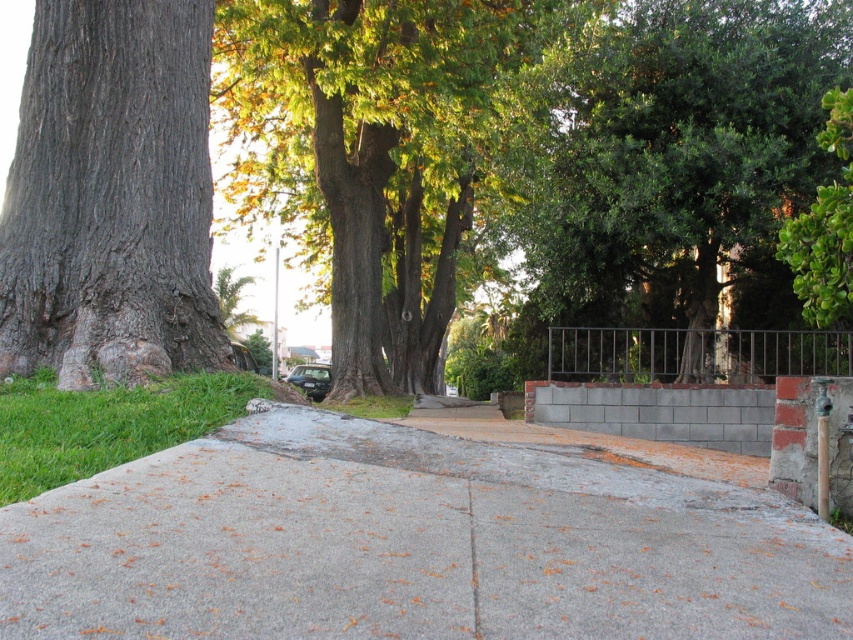
How distant is gray concrete pavement at center from green leafy tree at center?

19.36 meters

Which is above, gray concrete pavement at center or green leafy tree at center?

green leafy tree at center is above.

Which is in front, point (280, 406) or point (500, 45)?

Positioned in front is point (280, 406).

This screenshot has width=853, height=640. I want to click on gray concrete pavement at center, so click(410, 545).

Which is more to the left, gray concrete pavement at center or gray concrete curb at center?

Positioned to the left is gray concrete pavement at center.

Is point (624, 589) positioned before point (737, 426)?

Yes, point (624, 589) is in front of point (737, 426).

Find the location of a particular element. gray concrete pavement at center is located at coordinates (410, 545).

What do you see at coordinates (410, 545) in the screenshot? I see `gray concrete pavement at center` at bounding box center [410, 545].

Which is more to the left, gray concrete pavement at center or brown rough bark tree at left?

brown rough bark tree at left is more to the left.

Does point (618, 499) lie in front of point (21, 372)?

That is True.

Where is `gray concrete pavement at center`? Image resolution: width=853 pixels, height=640 pixels. gray concrete pavement at center is located at coordinates click(x=410, y=545).